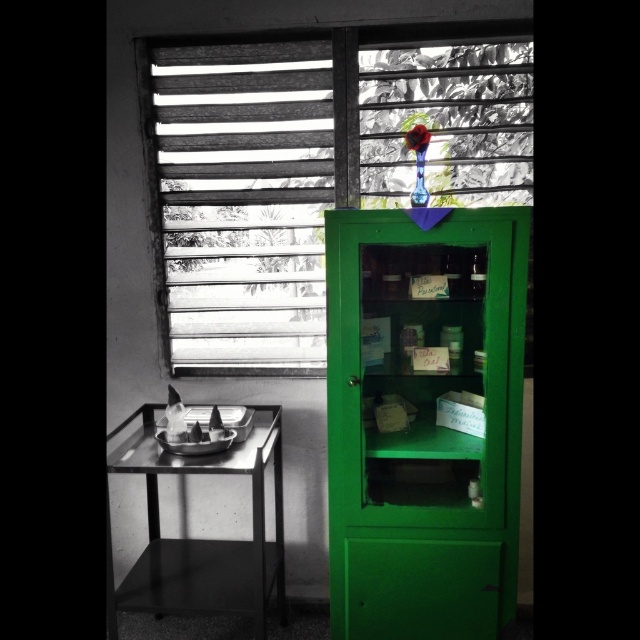
Identify the location of wooden slats at upper center. This screenshot has width=640, height=640. (312, 168).

Can you confirm if wooden slats at upper center is smaller than metallic black table at left?

No.

The height and width of the screenshot is (640, 640). What do you see at coordinates (312, 168) in the screenshot? I see `wooden slats at upper center` at bounding box center [312, 168].

Where is `wooden slats at upper center`? This screenshot has width=640, height=640. wooden slats at upper center is located at coordinates (312, 168).